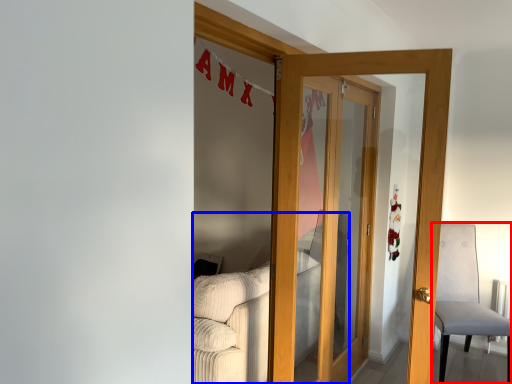
Question: Which object is further to the camera taking this photo, chair (highlighted by a red box) or couch (highlighted by a blue box)?

Choices:
 (A) chair
 (B) couch

Answer: (A)